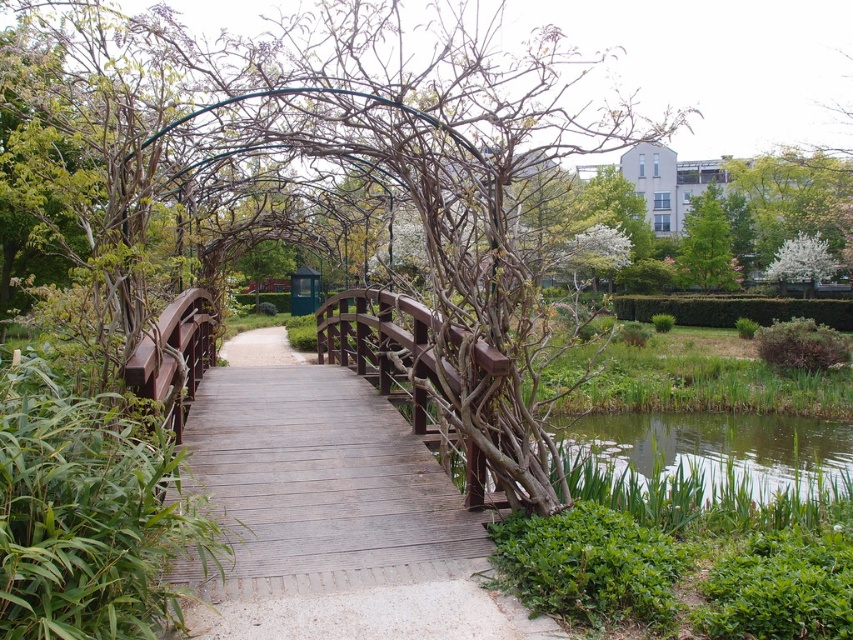
Question: In this image, where is brown wood bridge at center located relative to green grassy water at lower right?

Choices:
 (A) below
 (B) above

Answer: (B)

Question: Among these objects, which one is nearest to the camera?

Choices:
 (A) green leafy tree at upper right
 (B) green grassy water at lower right

Answer: (B)

Question: Which is nearer to the brown wood bridge at center?

Choices:
 (A) green grassy water at lower right
 (B) green leafy tree at upper right

Answer: (A)

Question: Does brown wood bridge at center have a greater width compared to green grassy water at lower right?

Choices:
 (A) yes
 (B) no

Answer: (A)

Question: Among these objects, which one is farthest from the camera?

Choices:
 (A) brown wood bridge at center
 (B) green grassy water at lower right
 (C) green leafy tree at upper right

Answer: (C)

Question: Is green grassy water at lower right bigger than green leafy tree at upper right?

Choices:
 (A) no
 (B) yes

Answer: (A)